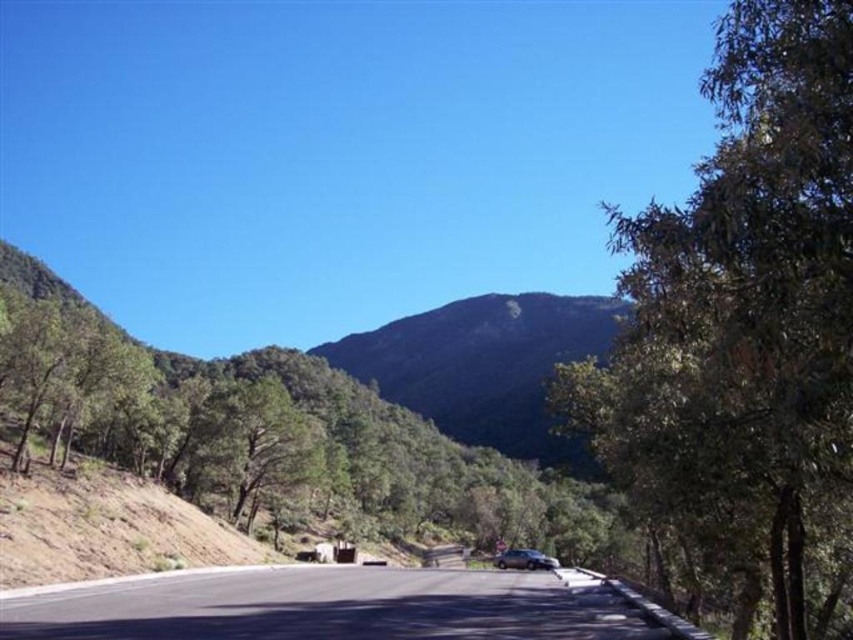
You are standing on the scenic road and want to take a photo of the green leafy tree at right. If your camera has a maximum focus range of 15 meters, will it be able to capture the tree clearly?

The green leafy tree at right is 14.55 meters away from the viewer. Since the camera can focus up to 15 meters, it will be able to capture the tree clearly within its maximum focus range.

You are driving a car and see the green leafy tree at right and the black asphalt road at center. Which object is closer to you?

The green leafy tree at right is closer to you because it is in front of the black asphalt road at center.